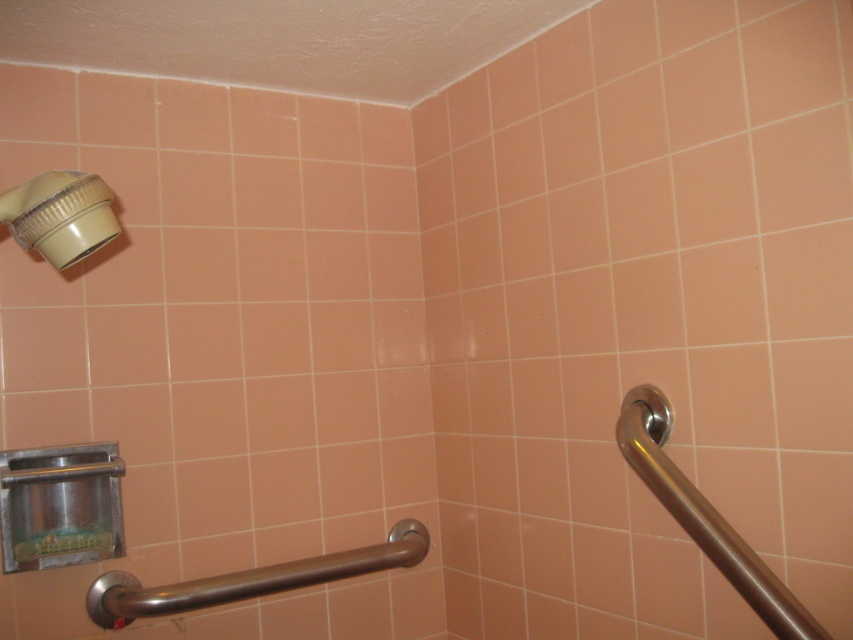
Question: Is polished stainless steel grab bar at right thinner than matte white showerhead at upper left?

Choices:
 (A) yes
 (B) no

Answer: (B)

Question: Which of the following is the closest to the observer?

Choices:
 (A) (375, 572)
 (B) (33, 250)

Answer: (B)

Question: Can you confirm if polished stainless steel grab bar at right is smaller than satin nickel grab bar at lower center?

Choices:
 (A) yes
 (B) no

Answer: (A)

Question: Estimate the real-world distances between objects in this image. Which object is closer to the matte white showerhead at upper left?

Choices:
 (A) satin nickel grab bar at lower center
 (B) polished stainless steel grab bar at right

Answer: (A)

Question: Considering the relative positions of polished stainless steel grab bar at right and satin nickel grab bar at lower center in the image provided, where is polished stainless steel grab bar at right located with respect to satin nickel grab bar at lower center?

Choices:
 (A) above
 (B) below

Answer: (A)

Question: Which is farther from the satin nickel grab bar at lower center?

Choices:
 (A) matte white showerhead at upper left
 (B) polished stainless steel grab bar at right

Answer: (A)